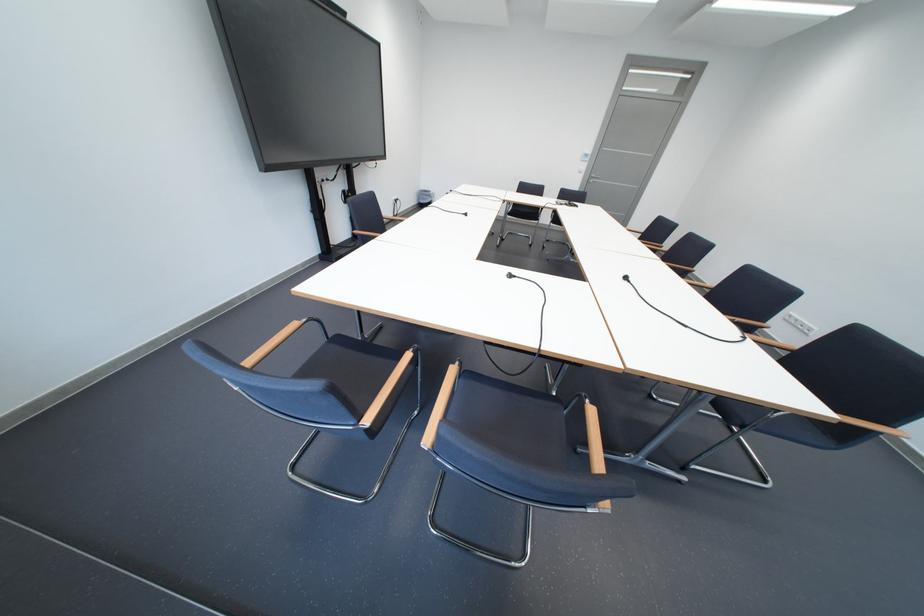
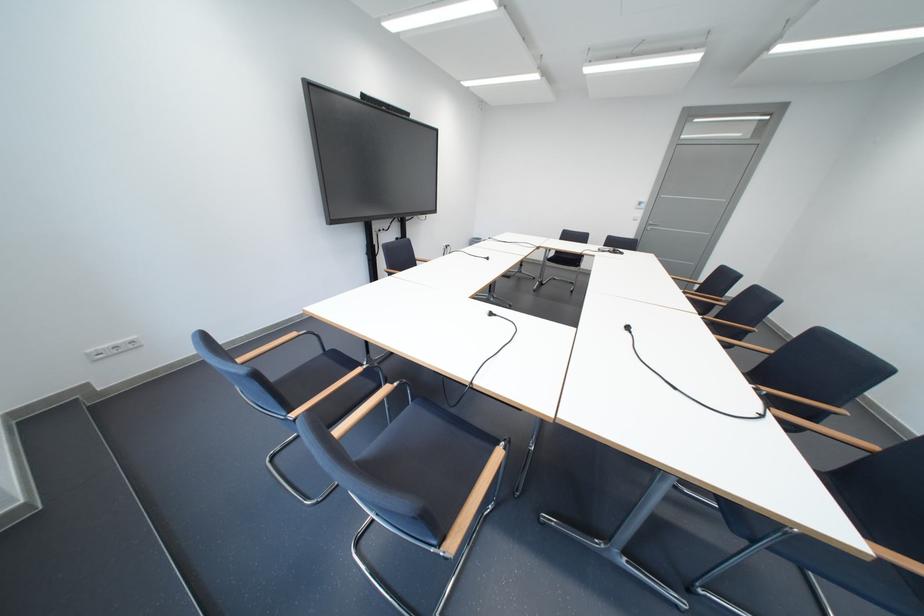
In the second image, find the point that corresponds to point (602, 180) in the first image.

(660, 227)